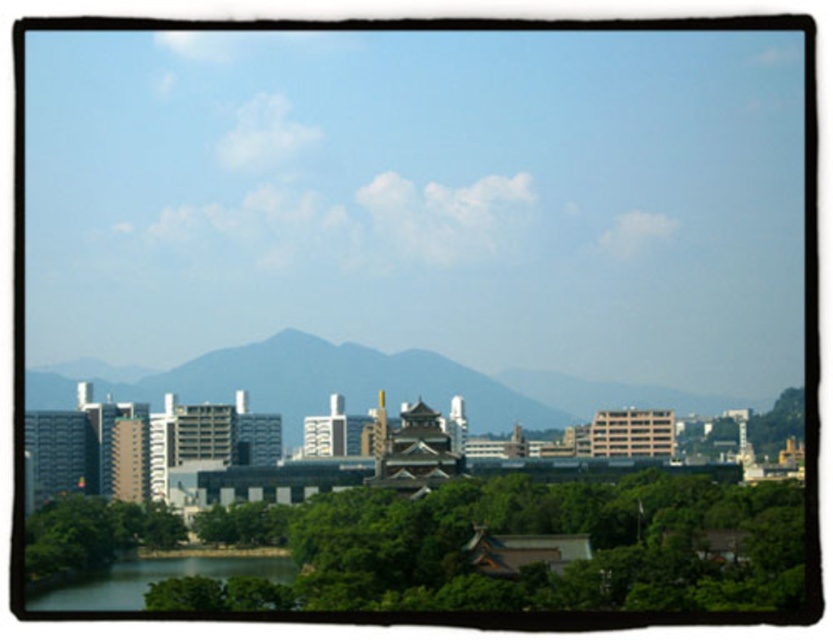
Is point (771, 502) closer to camera compared to point (313, 408)?

No, (771, 502) is further to viewer.

Is green leafy trees at lower center positioned at the back of gray/smooth mountain at center?

Yes.

Identify the location of green leafy trees at lower center. Image resolution: width=833 pixels, height=640 pixels. (505, 548).

At what (x,y) coordinates should I click in order to perform the action: click on green leafy trees at lower center. Please return your answer as a coordinate pair (x, y). The width and height of the screenshot is (833, 640). Looking at the image, I should click on (505, 548).

Is green leafy trees at lower center taller than green smooth water at lower left?

Yes.

Can you confirm if green leafy trees at lower center is positioned below green smooth water at lower left?

Actually, green leafy trees at lower center is above green smooth water at lower left.

Does point (676, 582) lie behind point (108, 604)?

No, it is in front of (108, 604).

Locate an element on the screen. The width and height of the screenshot is (833, 640). green leafy trees at lower center is located at coordinates (505, 548).

Between gray/smooth mountain at center and green smooth water at lower left, which one is positioned higher?

gray/smooth mountain at center is above.

Can you confirm if gray/smooth mountain at center is shorter than green smooth water at lower left?

No.

Who is more forward, (305, 372) or (96, 593)?

Point (305, 372) is in front.

You are a GUI agent. You are given a task and a screenshot of the screen. Output one action in this format:
    pyautogui.click(x=<x>, y=<y>)
    Task: Click on the gray/smooth mountain at center
    
    Given the screenshot: What is the action you would take?
    pyautogui.click(x=360, y=385)